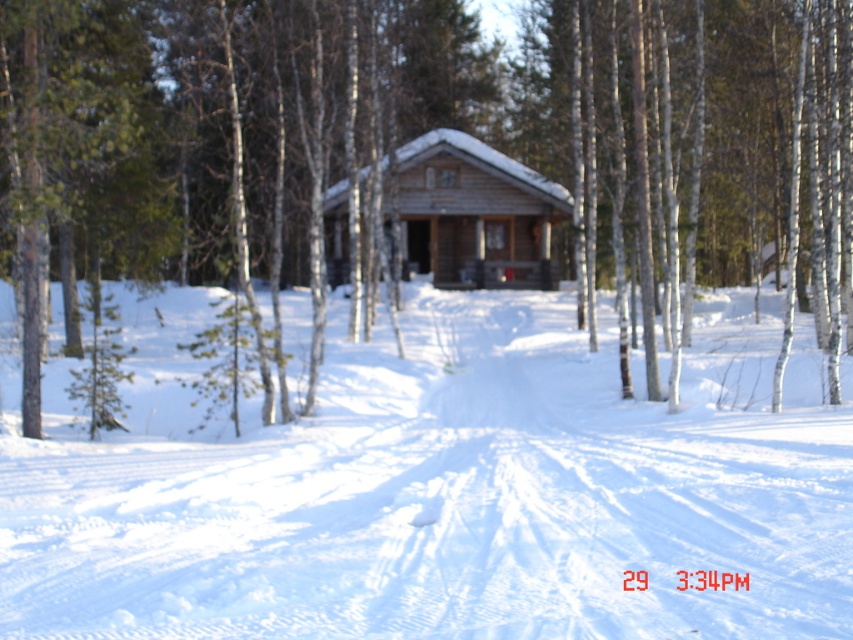
Question: Is white powdery snow at center closer to camera compared to wooden cabin at center?

Choices:
 (A) yes
 (B) no

Answer: (A)

Question: Among these objects, which one is farthest from the camera?

Choices:
 (A) white powdery snow at center
 (B) brown wood log cabin at center

Answer: (B)

Question: Where is brown wood log cabin at center located in relation to white powdery snow at center in the image?

Choices:
 (A) below
 (B) above

Answer: (B)

Question: Which point is closer to the camera?

Choices:
 (A) (515, 220)
 (B) (827, 36)
 (C) (218, 605)

Answer: (C)

Question: Can you confirm if brown wood log cabin at center is positioned to the left of white powdery snow at center?

Choices:
 (A) yes
 (B) no

Answer: (B)

Question: Estimate the real-world distances between objects in this image. Which object is farther from the brown wood log cabin at center?

Choices:
 (A) white powdery snow at center
 (B) wooden cabin at center

Answer: (A)